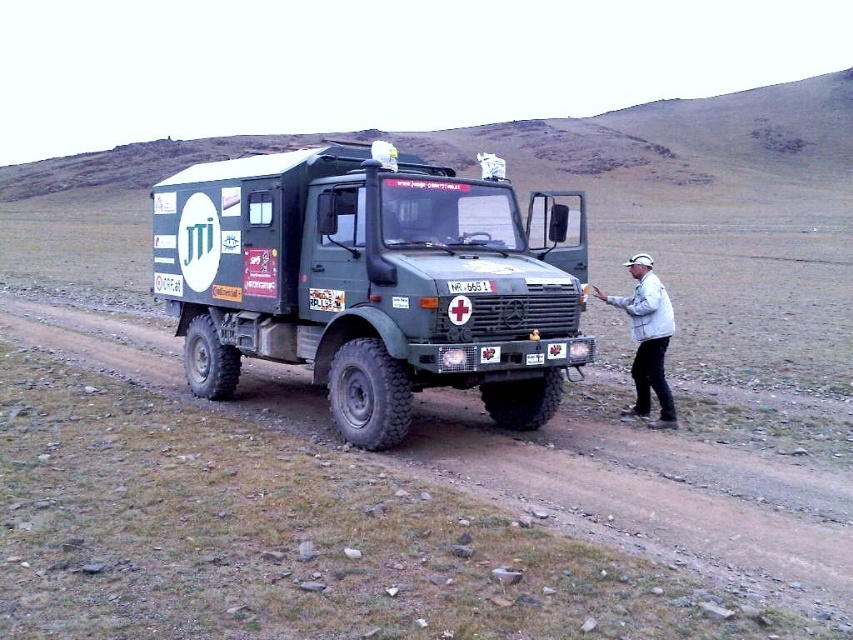
You are standing in front of the Mercedes Benz Unimog vehicle. There are two points marked on the vehicle. One is at coordinate point (393,278) and the other is at point (160,275). Which point is closer to you?

Point (393,278) is closer to the viewer than point (160,275).

You are a hiker who just arrived at the scene and notice the white matte jacket at right and the white plastic license plate at center. Which object is closer to the ground?

The white matte jacket at right is positioned under the white plastic license plate at center, so it is closer to the ground.

You are a photographer trying to capture the white matte jacket at right and the white plastic license plate at center in a single frame. Based on their sizes, will both objects fit within the camera viewfinder if the jacket is wider?

The white matte jacket at right might be wider than the white plastic license plate at center, so there is a possibility that both objects can fit within the camera viewfinder if the jacket is positioned appropriately. However, the exact arrangement depends on their actual widths and the camera angle.